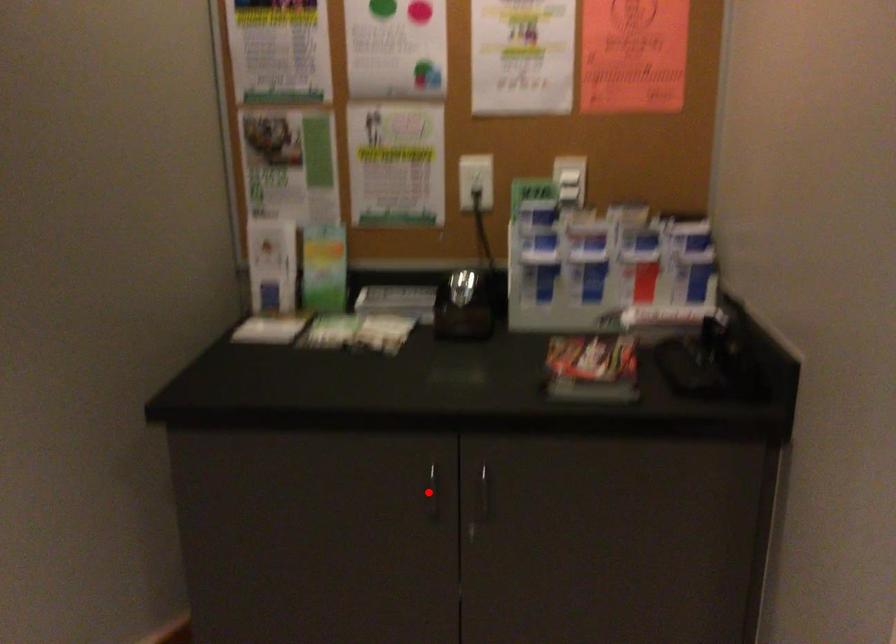
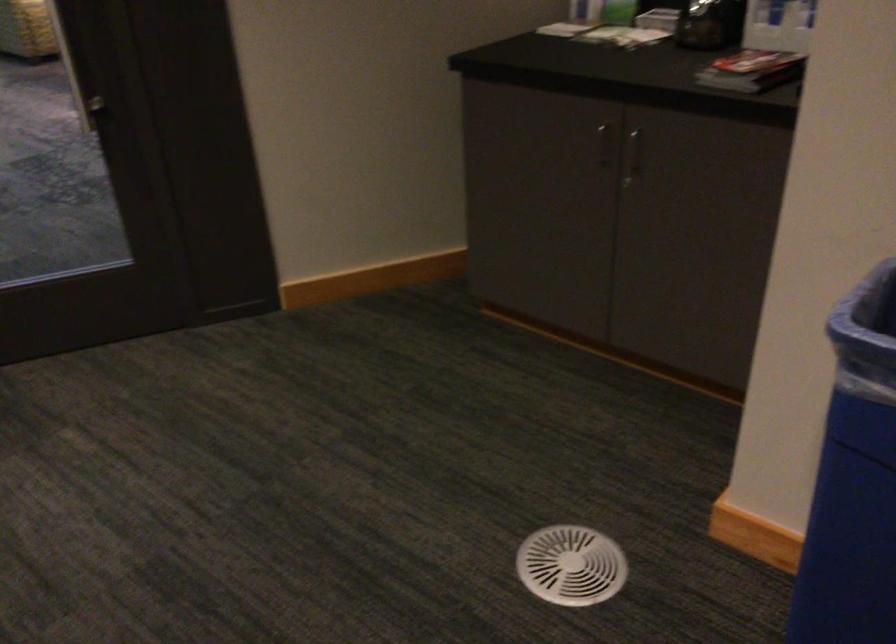
The point at the highlighted location is marked in the first image. Where is the corresponding point in the second image?

(604, 144)